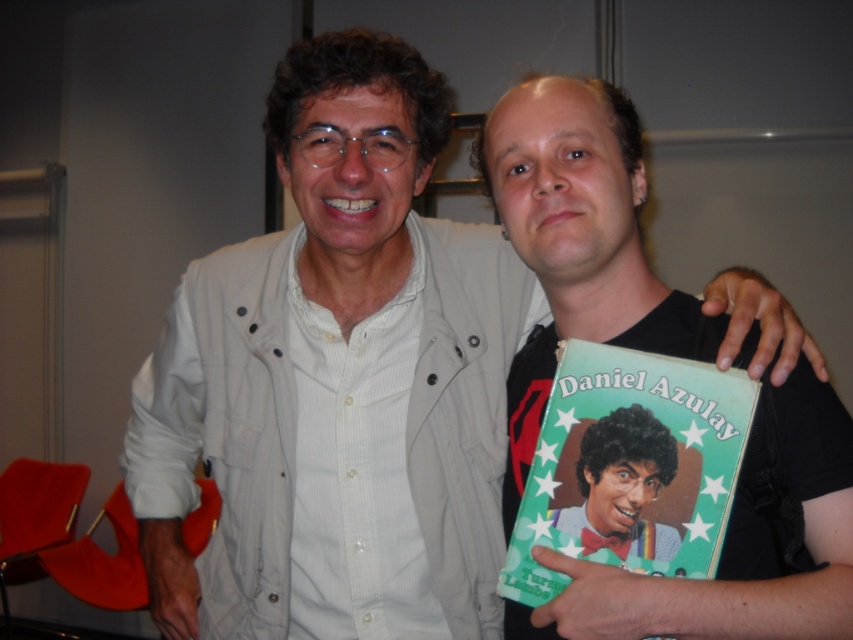
Question: Which point appears closest to the camera in this image?

Choices:
 (A) (654, 497)
 (B) (762, 616)
 (C) (720, 435)

Answer: (B)

Question: Is black matte book at center closer to camera compared to curly-haired man at center?

Choices:
 (A) no
 (B) yes

Answer: (B)

Question: Estimate the real-world distances between objects in this image. Which object is closer to the black matte book at center?

Choices:
 (A) green paper book at center
 (B) curly-haired man at center

Answer: (A)

Question: Which object is positioned closest to the curly-haired man at center?

Choices:
 (A) green paper book at center
 (B) black matte book at center

Answer: (A)

Question: Is black matte book at center to the right of curly-haired man at center from the viewer's perspective?

Choices:
 (A) no
 (B) yes

Answer: (A)

Question: Is green paper book at center behind curly-haired man at center?

Choices:
 (A) yes
 (B) no

Answer: (B)